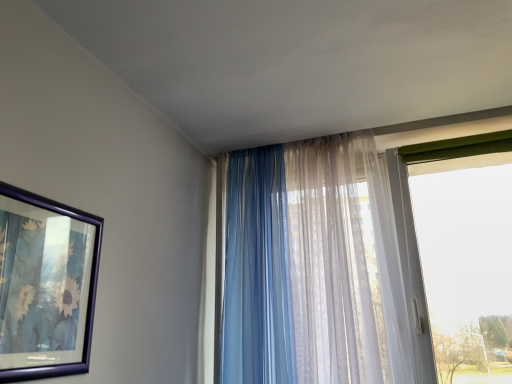
Question: From a real-world perspective, is metallic blue picture frame at left positioned above or below translucent sheer curtain at right, which is the second curtain in left-to-right order?

Choices:
 (A) below
 (B) above

Answer: (A)

Question: Is metallic blue picture frame at left in front of or behind translucent sheer curtain at right, which is the second curtain in left-to-right order, in the image?

Choices:
 (A) front
 (B) behind

Answer: (A)

Question: Considering the real-world distances, which object is closest to the translucent sheer curtain at right, the 1th curtain viewed from the right?

Choices:
 (A) translucent fabric curtain at center, which ranks as the second curtain in right-to-left order
 (B) metallic blue picture frame at left

Answer: (A)

Question: Which of these objects is positioned closest to the translucent sheer curtain at right, the 1th curtain viewed from the right?

Choices:
 (A) translucent fabric curtain at center, the first curtain when ordered from left to right
 (B) metallic blue picture frame at left

Answer: (A)